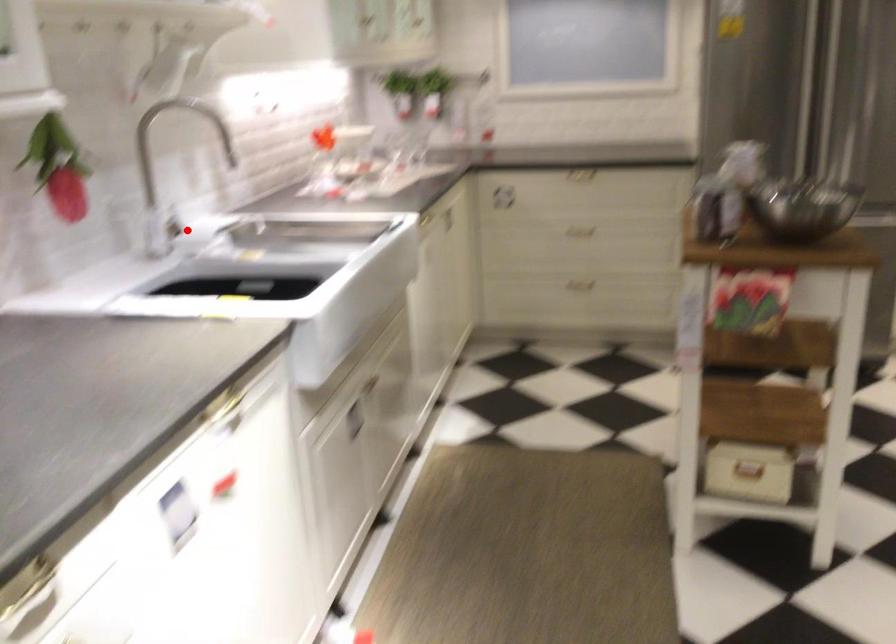
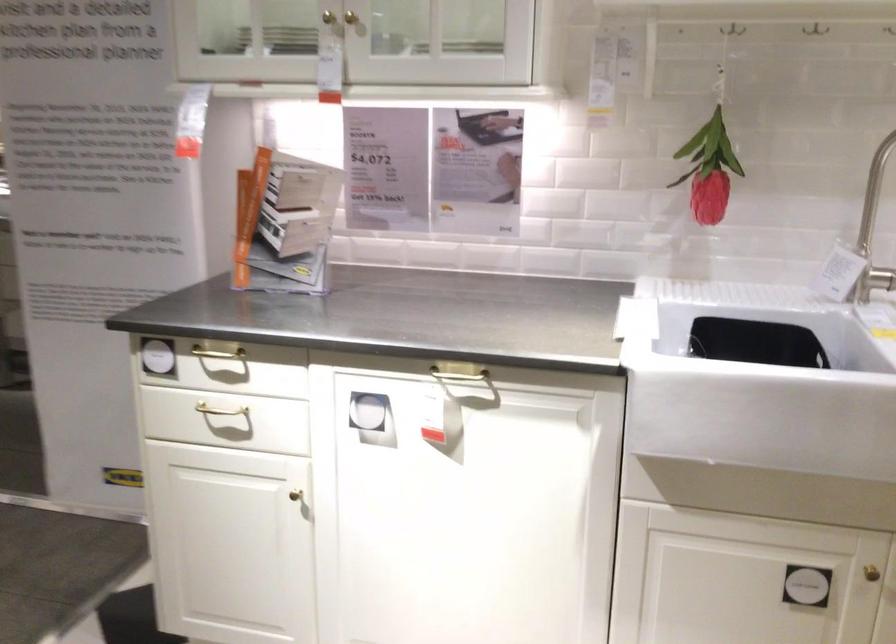
Where in the second image is the point corresponding to the highlighted location from the first image?

(880, 278)